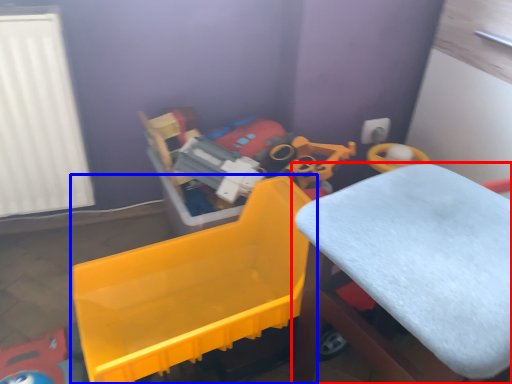
Question: Which of the following is the closest to the observer, furniture (highlighted by a red box) or toy (highlighted by a blue box)?

Choices:
 (A) furniture
 (B) toy

Answer: (A)